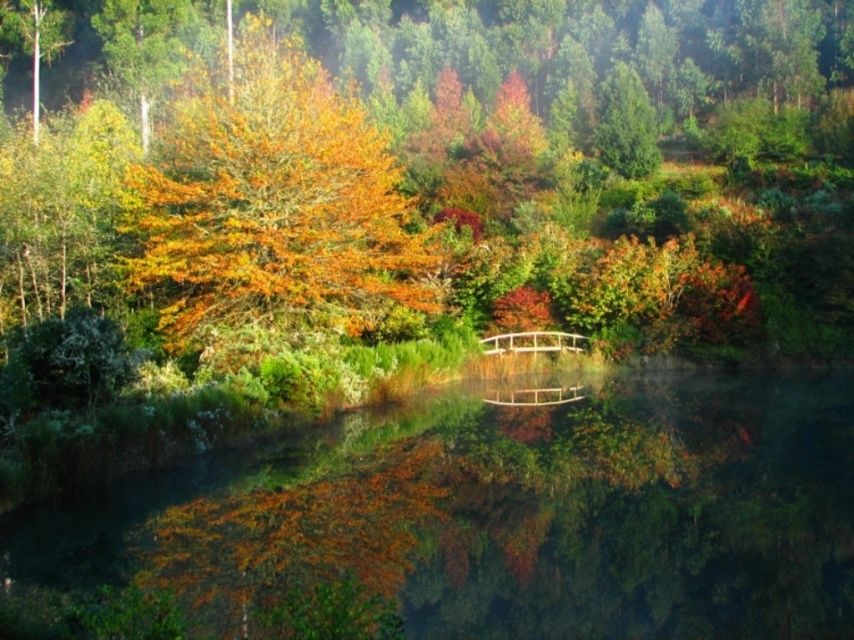
In the scene shown: You are standing at point (192, 104) and want to reach the small white wooden bridge. The distance between you and the bridge is 73.37 meters. Is the bridge within a 100 meter walking distance?

The distance between you and the small white wooden bridge is 73.37 meters, which is within 100 meters, so yes, the bridge is within walking distance.

You are standing at the edge of the pond in the autumnal landscape and notice two points marked on the water surface. The first point is labeled as point (383, 275), and the second is point (624, 124). From your perspective, which point is closer to you?

Point (383, 275) is in front of point (624, 124), so it is closer to you.